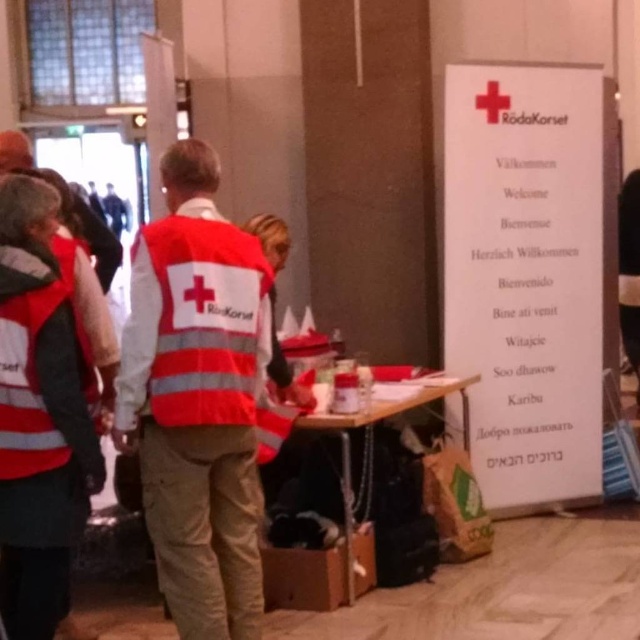
You are a volunteer at the Swedish Red Cross event and need to choose between the reflective orange safety vest at left and the reflective silver vest at left. Which vest will have a higher visibility when viewed from above?

The reflective orange safety vest at left is much taller than the reflective silver vest at left, so it will have higher visibility when viewed from above.